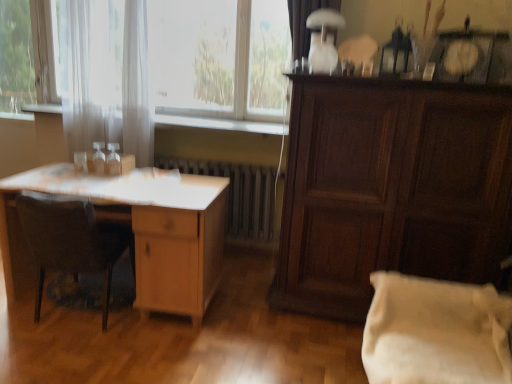
Question: From the image's perspective, is white sheer curtain at upper left positioned above or below white cotton pillow at lower right?

Choices:
 (A) below
 (B) above

Answer: (B)

Question: Looking at their shapes, would you say white sheer curtain at upper left is wider or thinner than white cotton pillow at lower right?

Choices:
 (A) wide
 (B) thin

Answer: (B)

Question: Estimate the real-world distances between objects in this image. Which object is farther from the dark wood cabinet at right?

Choices:
 (A) white wood at center
 (B) white sheer curtain at upper left
 (C) white matte curtain at upper center, acting as the second curtain starting from the left
 (D) metallic silver radiator at center
 (E) wooden chair at left

Answer: (E)

Question: Which of these objects is positioned farthest from the wooden chair at left?

Choices:
 (A) white sheer curtain at left, which is the 1th curtain from back to front
 (B) light wood desk at left
 (C) white cotton pillow at lower right
 (D) dark wood cabinet at right
 (E) metallic silver radiator at center

Answer: (C)